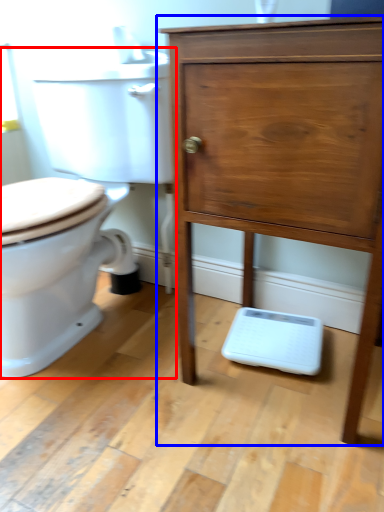
Question: Among these objects, which one is farthest to the camera, toilet (highlighted by a red box) or chest of drawers (highlighted by a blue box)?

Choices:
 (A) toilet
 (B) chest of drawers

Answer: (A)